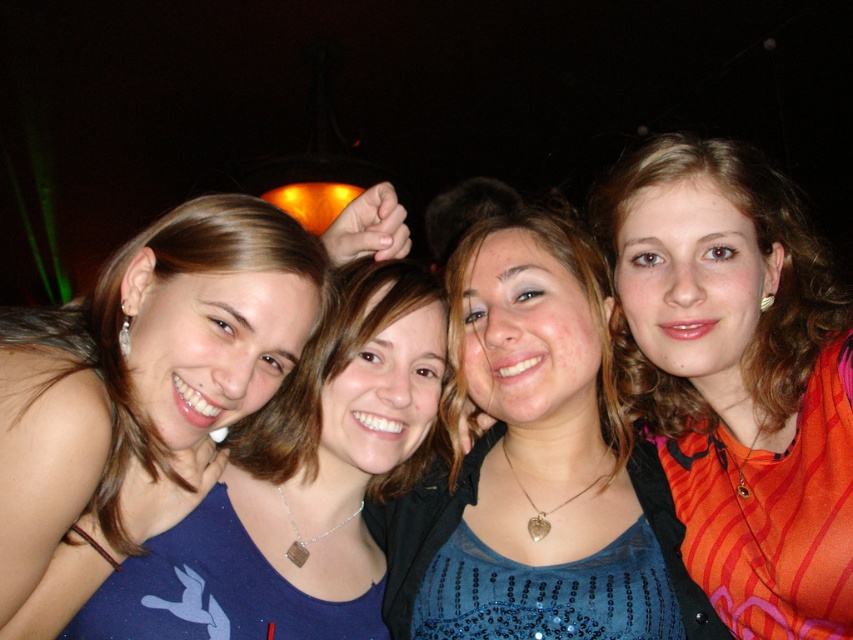
Question: Which object appears farthest from the camera in this image?

Choices:
 (A) orange striped shirt at right
 (B) blue sequined top at center

Answer: (B)

Question: Which point is closer to the camera taking this photo?

Choices:
 (A) (761, 529)
 (B) (415, 561)

Answer: (A)

Question: Which point is farther to the camera?

Choices:
 (A) (659, 253)
 (B) (408, 611)

Answer: (A)

Question: Is orange striped shirt at right bigger than blue sequined top at center?

Choices:
 (A) yes
 (B) no

Answer: (A)

Question: Is orange striped shirt at right to the right of blue sequined top at center from the viewer's perspective?

Choices:
 (A) yes
 (B) no

Answer: (A)

Question: Does orange striped shirt at right appear on the right side of blue sequined top at center?

Choices:
 (A) no
 (B) yes

Answer: (B)